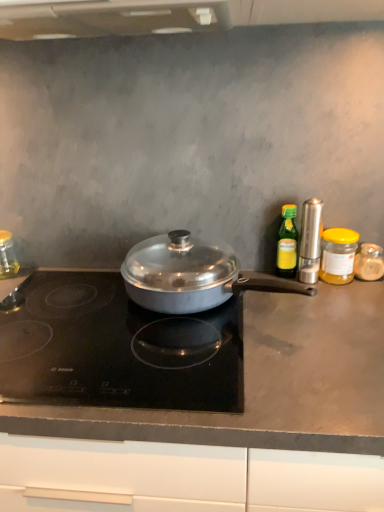
Where is `free location to the left of yellow glass jar at right, arranged as the fifth kitchen appliance when viewed from the left`? The image size is (384, 512). free location to the left of yellow glass jar at right, arranged as the fifth kitchen appliance when viewed from the left is located at coordinates (277, 291).